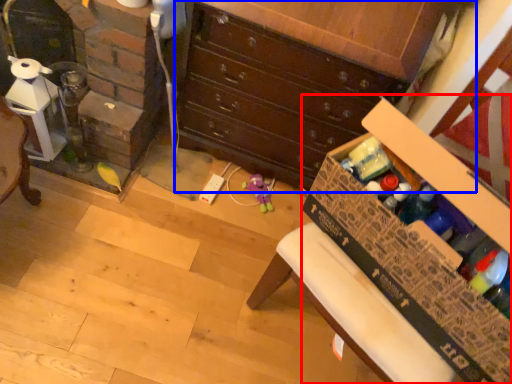
Question: Which object is closer to the camera taking this photo, cardboard box (highlighted by a red box) or chest of drawers (highlighted by a blue box)?

Choices:
 (A) cardboard box
 (B) chest of drawers

Answer: (A)